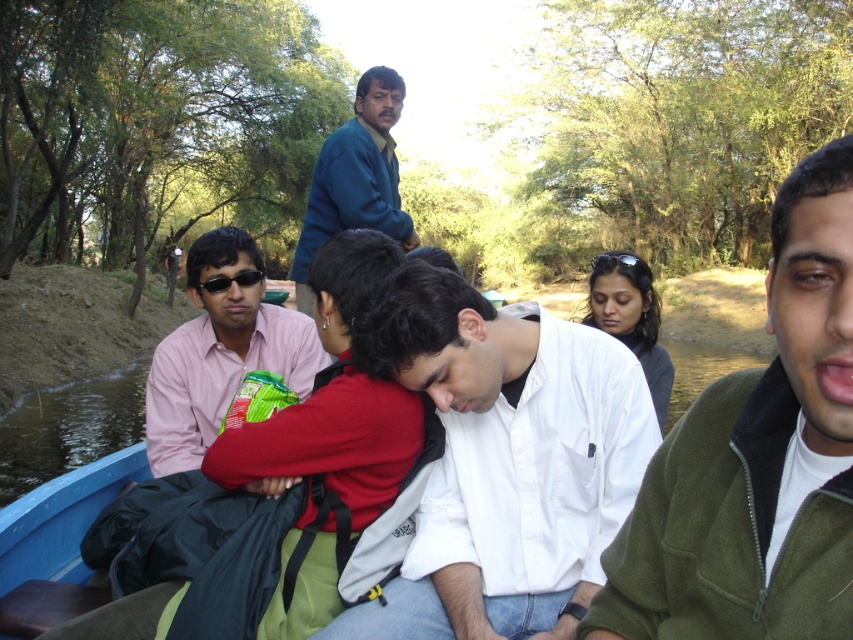
Between white matte shirt at center and green fleece jacket at upper right, which one has more height?

white matte shirt at center

How distant is white matte shirt at center from green fleece jacket at upper right?

A distance of 73.58 centimeters exists between white matte shirt at center and green fleece jacket at upper right.

Is point (584, 433) in front of point (724, 380)?

No, it is behind (724, 380).

This screenshot has width=853, height=640. Identify the location of white matte shirt at center. (503, 461).

Does white matte shirt at center have a larger size compared to teal sweater at upper center?

Incorrect, white matte shirt at center is not larger than teal sweater at upper center.

Where is `white matte shirt at center`? The image size is (853, 640). white matte shirt at center is located at coordinates (503, 461).

Where is `pink shirt at left`? The height and width of the screenshot is (640, 853). pink shirt at left is located at coordinates (219, 353).

Is point (257, 349) positioned after point (317, 227)?

No.

Locate an element on the screen. The height and width of the screenshot is (640, 853). pink shirt at left is located at coordinates (219, 353).